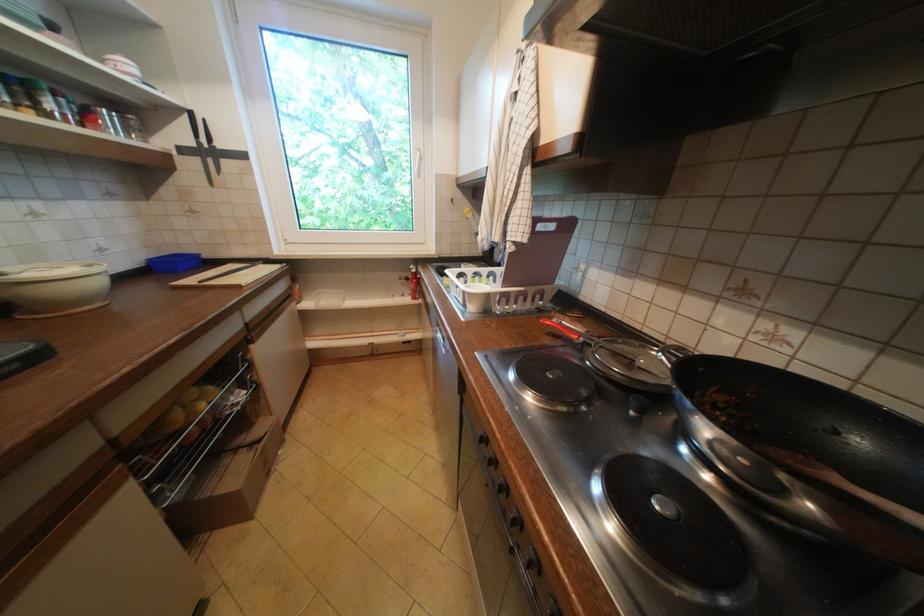
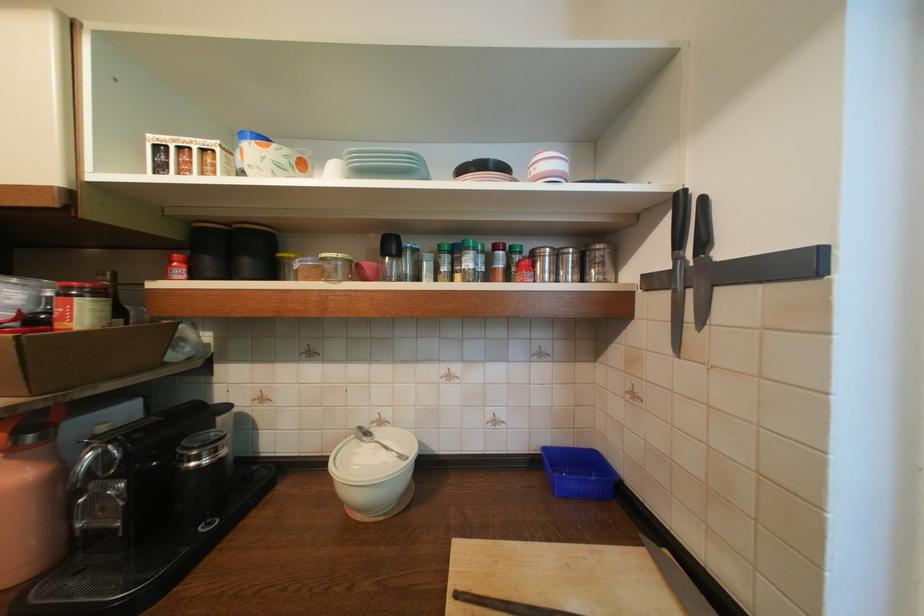
Locate, in the second image, the point that corresponds to (x=149, y=132) in the first image.

(611, 265)